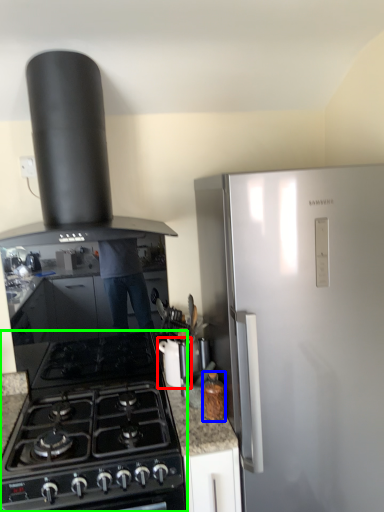
Question: Which is farther away from kitchen appliance (highlighted by a red box)? kitchen appliance (highlighted by a blue box) or gas stove (highlighted by a green box)?

Choices:
 (A) kitchen appliance
 (B) gas stove

Answer: (B)